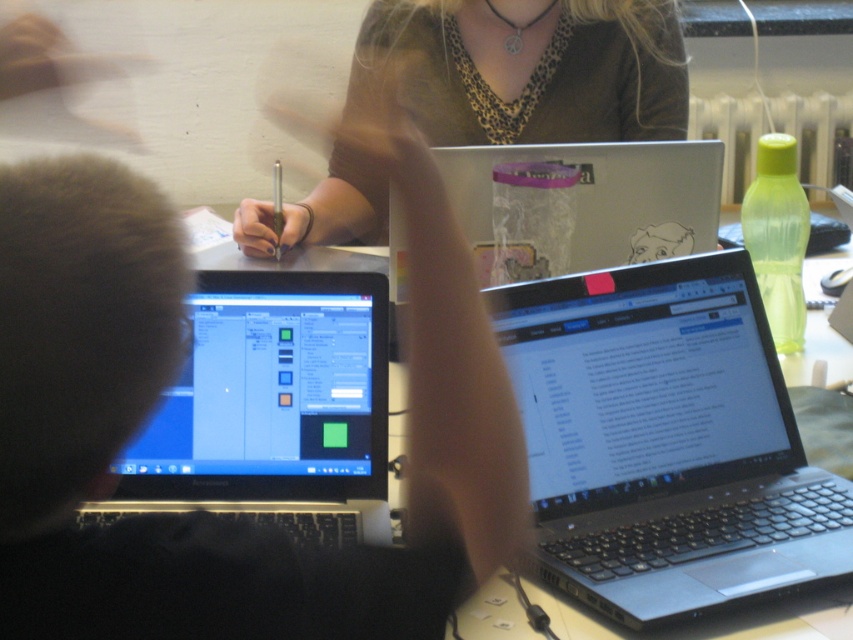
You are a student in the classroom and need to locate your laptop. You remember that the black matte laptop at left is positioned to the left of the matte black laptop at upper center. Which laptop is closer to the left edge of the table?

The black matte laptop at left is closer to the left edge of the table because it is positioned to the left of the matte black laptop at upper center.

You are a student in the classroom and need to use the largest laptop available. Which one should you choose between the black matte laptop at center and the matte black laptop at upper center?

The matte black laptop at upper center is taller than the black matte laptop at center, so you should choose the matte black laptop at upper center as it is the larger one.

You are a student in the classroom and need to use the black matte laptop at center and the matte black laptop at center for a project. Which one should you choose if you need more screen space for your work?

You should choose the black matte laptop at center because it is bigger than the matte black laptop at center, providing more screen space for your work.